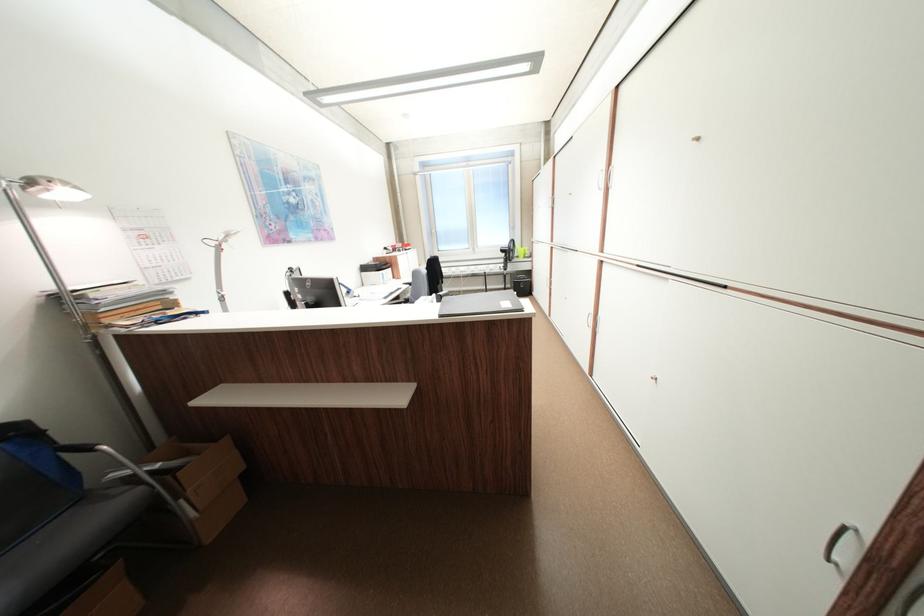
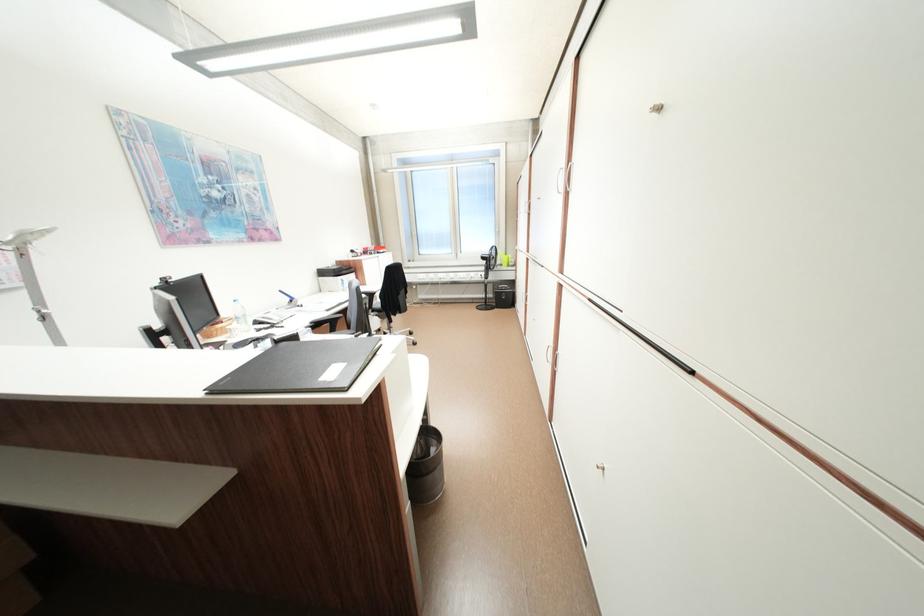
In the second image, find the point that corresponds to the point at 408,278 in the first image.

(373, 285)